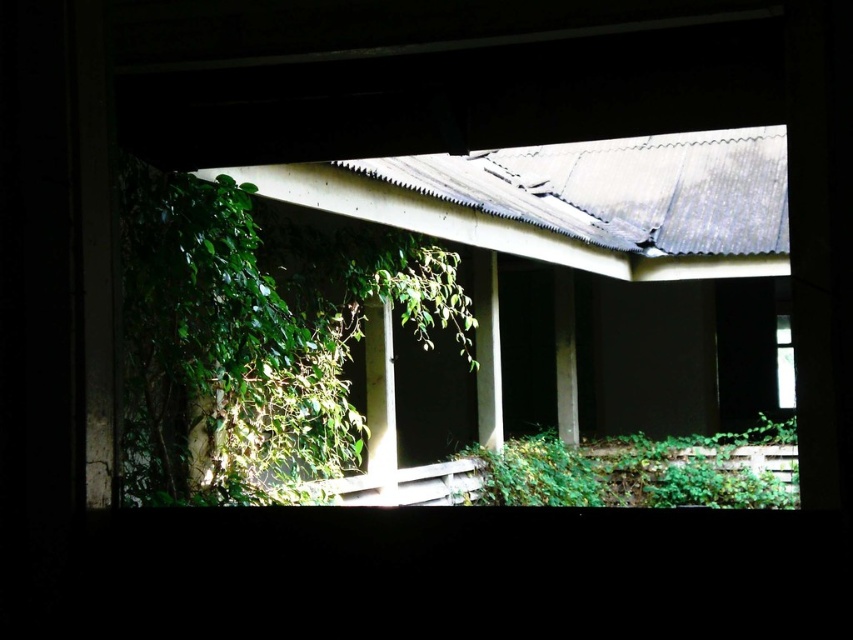
You are an interior designer assessing the space. You need to place a decorative item between the green leafy plant at left and the green leafy plant at lower right. Considering their widths, which plant is narrower and should be paired with a smaller decorative item?

The green leafy plant at left is narrower than the green leafy plant at lower right, so it should be paired with a smaller decorative item.

You are a gardener who needs to water two green leafy plants. You are standing at the center of the room. Which plant is closer to you, the green leafy plant at left or the green leafy plant at lower right?

The green leafy plant at left is closer to you than the green leafy plant at lower right because they are 3.61 meters apart.

You are an interior designer assessing the natural light in this space. Considering the green leafy plant at left and the green leafy plant at lower right, which one might cast a bigger shadow on the floor?

The green leafy plant at left is larger in size than the green leafy plant at lower right, so it would cast a bigger shadow on the floor.